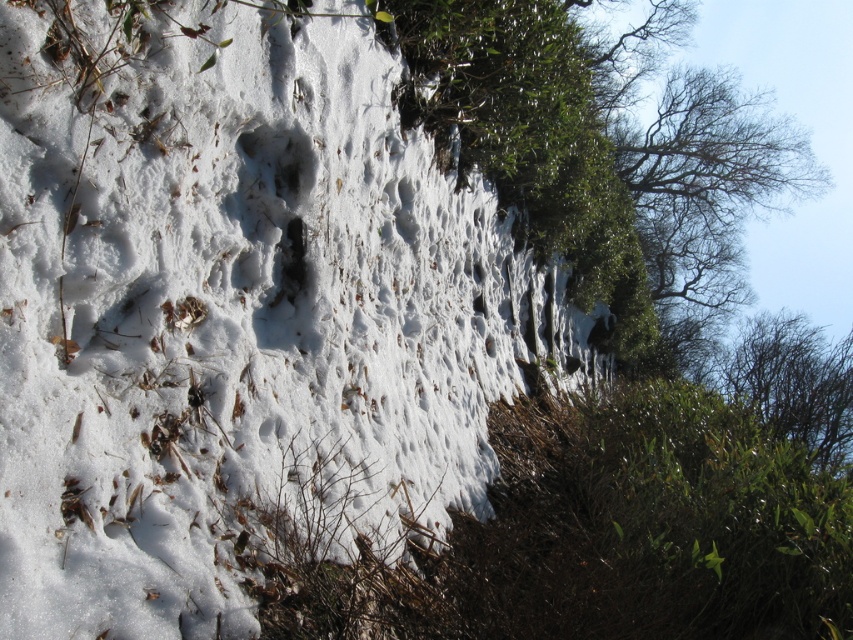
Question: Which of the following is the closest to the observer?

Choices:
 (A) (294, 124)
 (B) (775, 339)

Answer: (A)

Question: Is white fluffy snow at center positioned at the back of green leafy tree at upper right?

Choices:
 (A) yes
 (B) no

Answer: (B)

Question: Does white fluffy snow at center lie in front of green leafy tree at upper right?

Choices:
 (A) yes
 (B) no

Answer: (A)

Question: Does white fluffy snow at center have a larger size compared to green leafy tree at upper right?

Choices:
 (A) yes
 (B) no

Answer: (B)

Question: Among these points, which one is nearest to the camera?

Choices:
 (A) (785, 328)
 (B) (207, 109)

Answer: (B)